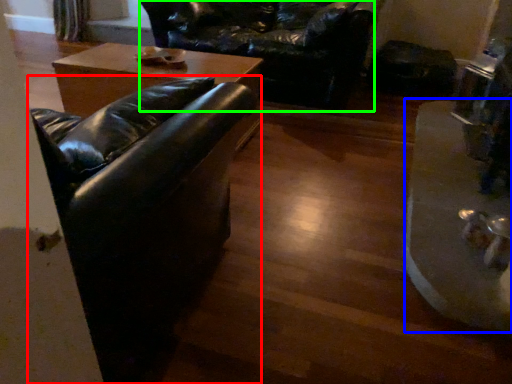
Question: Based on their relative distances, which object is nearer to studio couch (highlighted by a red box)? Choose from wide (highlighted by a blue box) and swivel chair (highlighted by a green box).

Choices:
 (A) wide
 (B) swivel chair

Answer: (A)